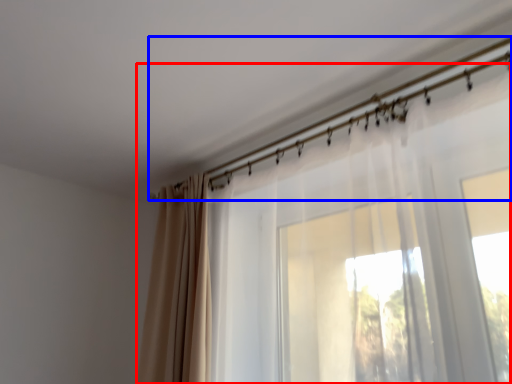
Question: Which object is further to the camera taking this photo, curtain (highlighted by a red box) or clothesline (highlighted by a blue box)?

Choices:
 (A) curtain
 (B) clothesline

Answer: (B)